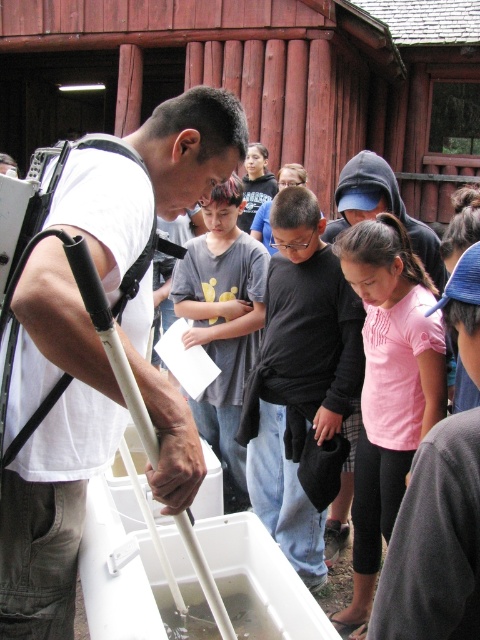
You are a photographer trying to capture a candid shot of the educational activity. You notice the white matte crutch at left and the pink cotton shirt at center. Which object should you focus on to ensure the subject fills the frame better due to its larger size?

The white matte crutch at left is wider than the pink cotton shirt at center, so focusing on it would better fill the frame due to its greater width.

You are a photographer trying to capture a group photo of the children and the man. The two participants wearing the black matte shirt at center and pink cotton shirt at center are standing close to each other. To ensure both are in focus, you need to know their relative positions. Which one is more to the left?

The black matte shirt at center is positioned on the left side of the pink cotton shirt at center, so the black matte shirt at center is more to the left.